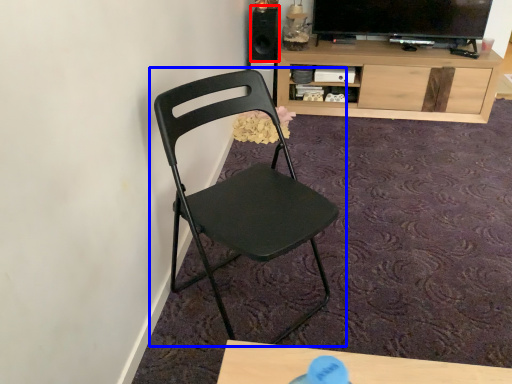
Question: Which of the following is the closest to the observer, speaker (highlighted by a red box) or chair (highlighted by a blue box)?

Choices:
 (A) speaker
 (B) chair

Answer: (B)